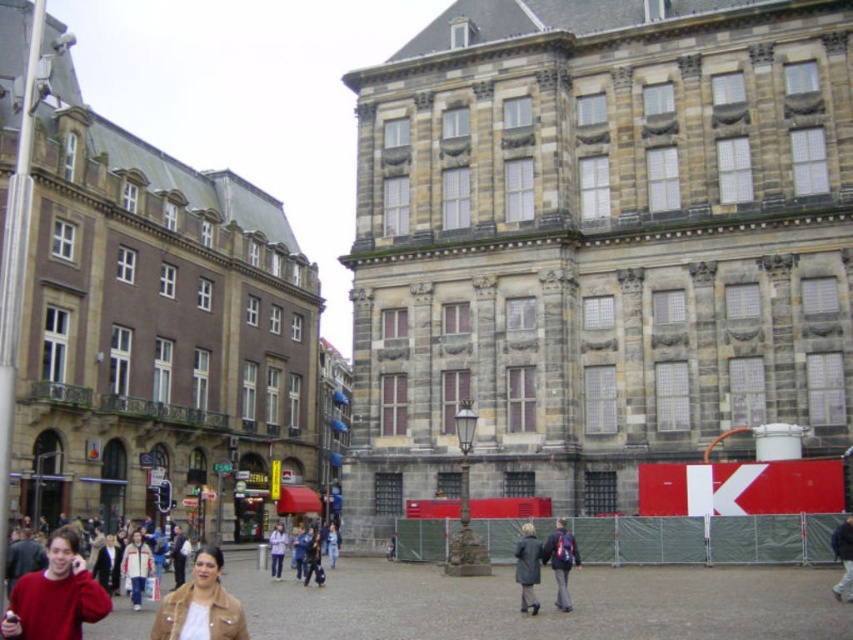
Which is in front, point (178, 621) or point (838, 592)?

Point (178, 621)

Does brown leather jacket at lower left have a larger size compared to dark blue jacket at center?

Correct, brown leather jacket at lower left is larger in size than dark blue jacket at center.

What do you see at coordinates (200, 605) in the screenshot?
I see `brown leather jacket at lower left` at bounding box center [200, 605].

Find the location of a particular element. The image size is (853, 640). brown leather jacket at lower left is located at coordinates (200, 605).

Between point (531, 572) and point (842, 579), which one is positioned behind?

The point (842, 579) is more distant.

Is dark gray coat at center bigger than dark blue jacket at center?

No.

Locate an element on the screen. The height and width of the screenshot is (640, 853). dark gray coat at center is located at coordinates (527, 566).

Locate an element on the screen. dark gray coat at center is located at coordinates (527, 566).

The image size is (853, 640). What do you see at coordinates (843, 557) in the screenshot?
I see `dark blue jacket at center` at bounding box center [843, 557].

Is dark blue jacket at center thinner than light purple jacket at center?

Yes.

At what (x,y) coordinates should I click in order to perform the action: click on dark blue jacket at center. Please return your answer as a coordinate pair (x, y). Image resolution: width=853 pixels, height=640 pixels. Looking at the image, I should click on (843, 557).